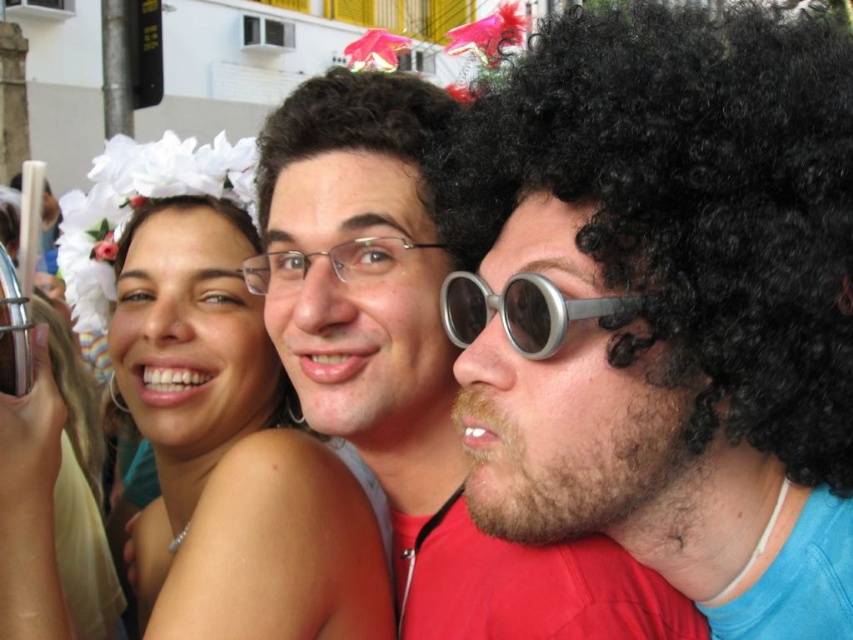
You are a photographer trying to adjust the lighting for a photo shoot. You need to position a spotlight directly above the metallic silver goggles at center. According to the image, where should you place the spotlight in terms of coordinates?

The metallic silver goggles at center are located at coordinates point (521, 310), so the spotlight should be placed directly above this point.

Consider the image. You are a photographer trying to adjust the lighting for a group photo. You notice the black curly wig at right and the smooth skin face at center. Which object is positioned higher in the image?

The black curly wig at right is above smooth skin face at center, so the black curly wig at right is positioned higher in the image.